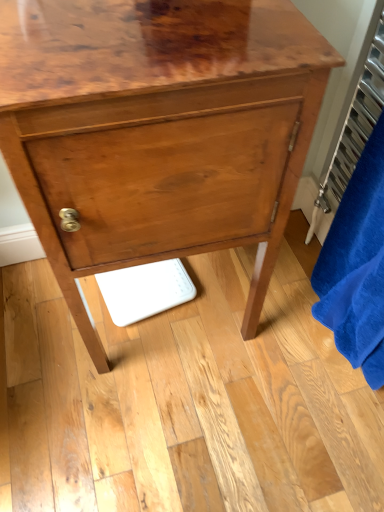
In order to click on blank space to the left of glossy wood chest of drawers at center in this screenshot , I will do `click(39, 330)`.